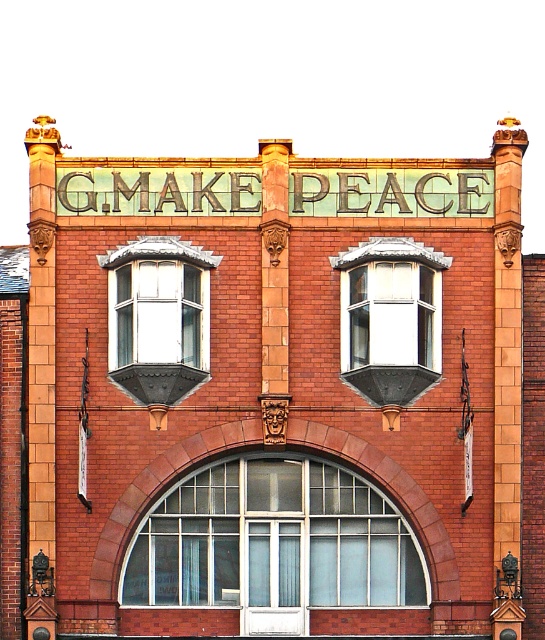
Who is more forward, (343, 484) or (371, 369)?

Point (371, 369) is in front.

The image size is (545, 640). What do you see at coordinates (274, 544) in the screenshot?
I see `clear glass window at center` at bounding box center [274, 544].

Who is more forward, (205, 595) or (404, 362)?

Point (404, 362)

At what (x,y) coordinates should I click in order to perform the action: click on clear glass window at center. Please return your answer as a coordinate pair (x, y). The image size is (545, 640). Looking at the image, I should click on (274, 544).

Does matte glass bay window at center appear on the right side of clear glass bay window at center?

No, matte glass bay window at center is not to the right of clear glass bay window at center.

Does matte glass bay window at center appear over clear glass bay window at center?

Yes.

Image resolution: width=545 pixels, height=640 pixels. In order to click on matte glass bay window at center in this screenshot , I will do `click(159, 317)`.

Who is higher up, clear glass window at center or matte glass bay window at center?

matte glass bay window at center

Where is `clear glass window at center`? Image resolution: width=545 pixels, height=640 pixels. clear glass window at center is located at coordinates (274, 544).